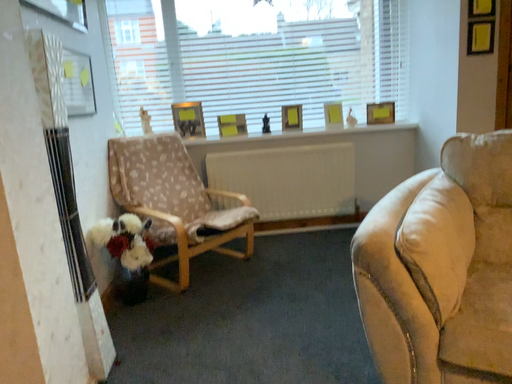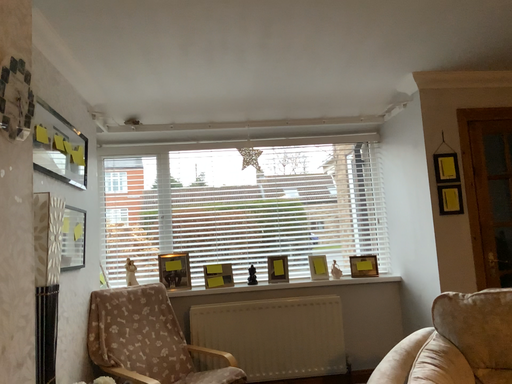
Question: Which way did the camera rotate in the video?

Choices:
 (A) rotated downward
 (B) rotated upward

Answer: (B)